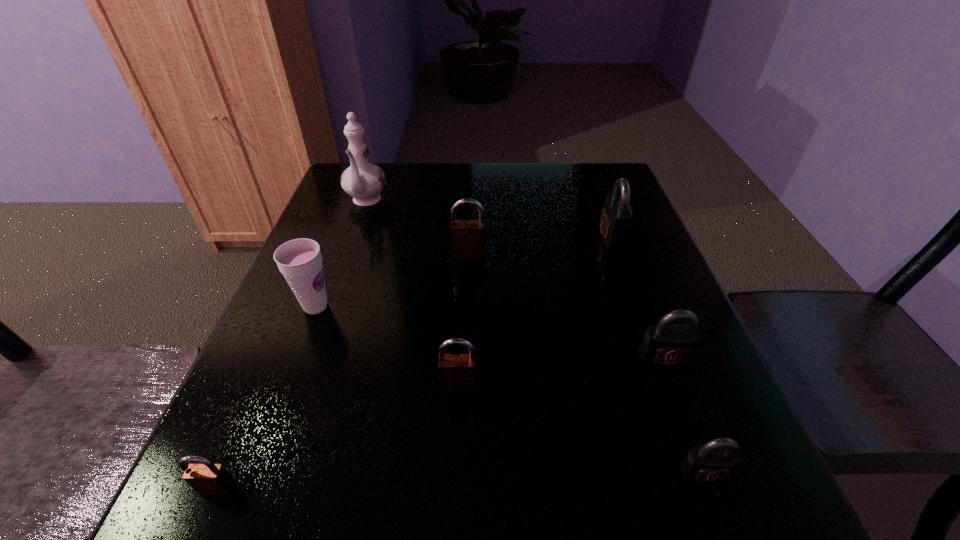
At what (x,y) coordinates should I click in order to perform the action: click on vacant space located 0.070m on the right of the fourth farthest object. Please return your answer as a coordinate pair (x, y). Looking at the image, I should click on (371, 306).

This screenshot has height=540, width=960. Identify the location of vacant space situated on the front-facing side of the second smallest brown padlock. (456, 462).

Find the location of a particular element. This screenshot has width=960, height=540. free point located 0.190m on the front of the second nearest gray padlock near the keyhole is located at coordinates (709, 477).

Locate an element on the screen. The height and width of the screenshot is (540, 960). object that is at the far edge is located at coordinates (364, 181).

At what (x,y) coordinates should I click in order to perform the action: click on chinaware that is at the left edge. Please return your answer as a coordinate pair (x, y). This screenshot has width=960, height=540. Looking at the image, I should click on (364, 181).

Where is `cup present at the left edge`? cup present at the left edge is located at coordinates pos(300,261).

This screenshot has height=540, width=960. Identify the location of padlock situated at the left edge. (207, 478).

The height and width of the screenshot is (540, 960). In order to click on object present at the far left corner in this screenshot , I will do `click(364, 181)`.

Where is `object present at the near left corner`? Image resolution: width=960 pixels, height=540 pixels. object present at the near left corner is located at coordinates (207, 478).

Image resolution: width=960 pixels, height=540 pixels. Identify the location of object present at the near right corner. (716, 460).